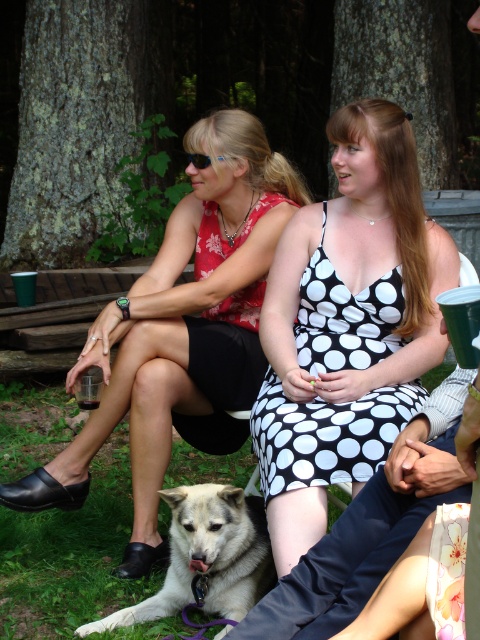
Question: Is black dotted dress at center closer to camera compared to white fur dog at lower left?

Choices:
 (A) no
 (B) yes

Answer: (A)

Question: Estimate the real-world distances between objects in this image. Which object is farther from the white fur dog at lower left?

Choices:
 (A) black dotted dress at center
 (B) matte black dress at center

Answer: (B)

Question: From the image, what is the correct spatial relationship of matte black dress at center in relation to white fur dog at lower left?

Choices:
 (A) left
 (B) right

Answer: (A)

Question: Does matte black dress at center have a greater width compared to white fur dog at lower left?

Choices:
 (A) yes
 (B) no

Answer: (A)

Question: Which object is farther from the camera taking this photo?

Choices:
 (A) matte black dress at center
 (B) white fur dog at lower left

Answer: (A)

Question: Which point is closer to the camera taking this photo?

Choices:
 (A) (334, 438)
 (B) (236, 516)

Answer: (A)